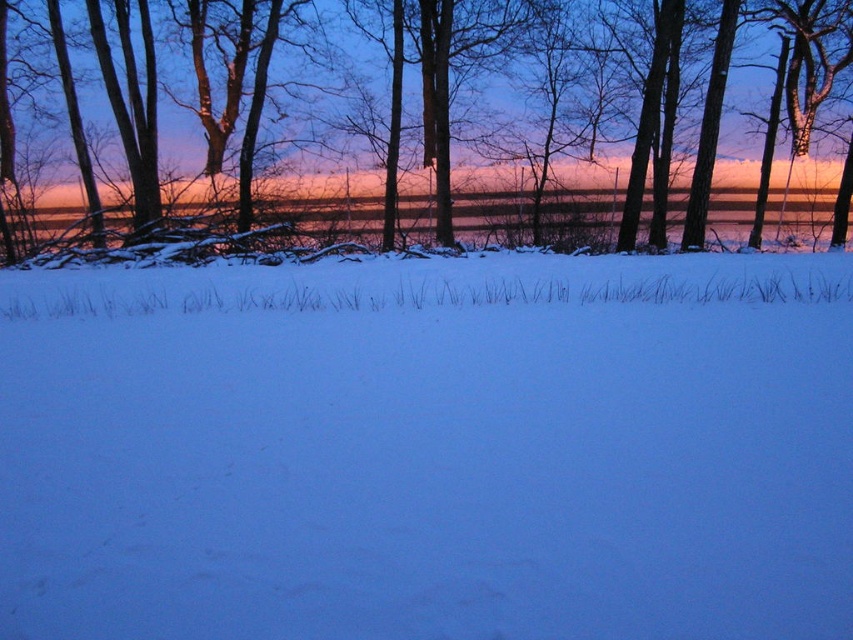
You are an artist trying to paint this winter scene. You want to ensure the smooth bark tree at upper center and the shiny metallic water at center are proportionally accurate. Which object should you make larger in your painting?

The smooth bark tree at upper center should be made larger than the shiny metallic water at center because it is described as larger in size.

You are standing at the bottom edge of the image where the faint tracks are. You want to walk directly toward the smooth bark tree at upper center. Which direction should you move?

You should move upward because the smooth bark tree at upper center is located at point coordinates of (456, 122), which is in the upper part of the image.